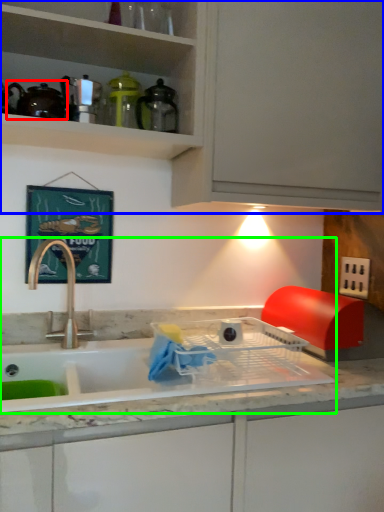
Question: Estimate the real-world distances between objects in this image. Which object is farther from tea pot (highlighted by a red box), cabinetry (highlighted by a blue box) or sink (highlighted by a green box)?

Choices:
 (A) cabinetry
 (B) sink

Answer: (B)